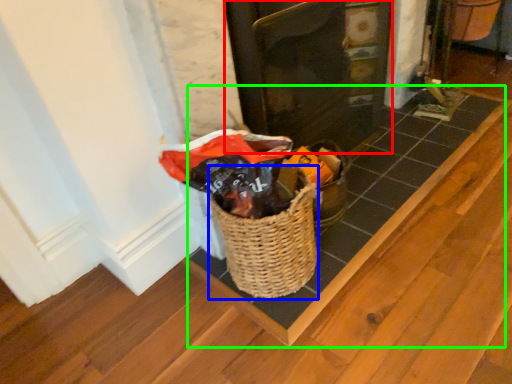
Question: Which is nearer to the door (highlighted by a red box)? basket (highlighted by a blue box) or plank (highlighted by a green box).

Choices:
 (A) basket
 (B) plank

Answer: (B)